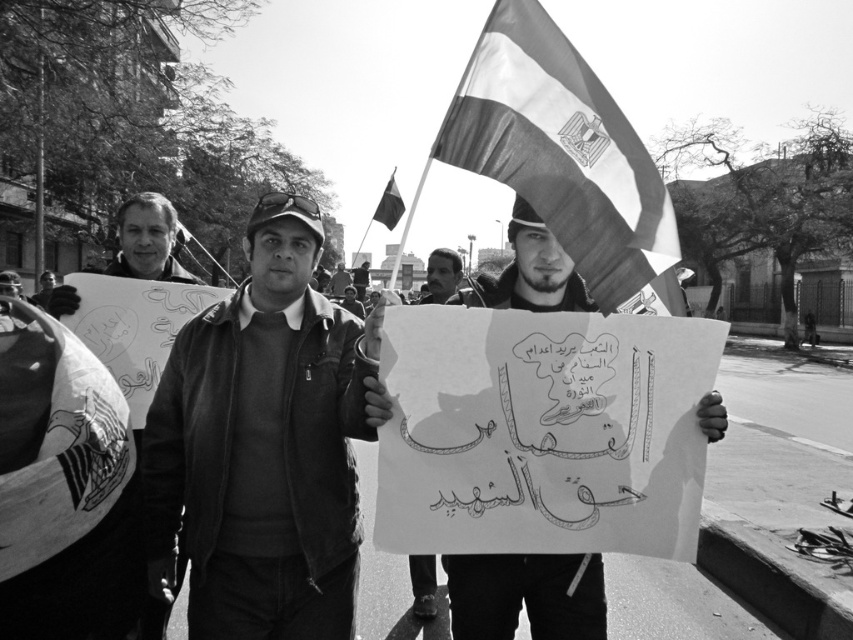
You are a photographer who wants to capture both the dark gray leather jacket at center and the smooth black shirt at center in a single photo. Can you position yourself so that both are fully visible without any obstruction from one another?

The dark gray leather jacket at center is in front of the smooth black shirt at center, so you cannot fully capture both without obstruction because the dark gray leather jacket at center will block part of the smooth black shirt at center.

Based on the scene description, which object is positioned lower in the image, the smooth paper sign at center or the smooth leather jacket at center?

The smooth paper sign at center is positioned below the smooth leather jacket at center, so it is lower in the image.